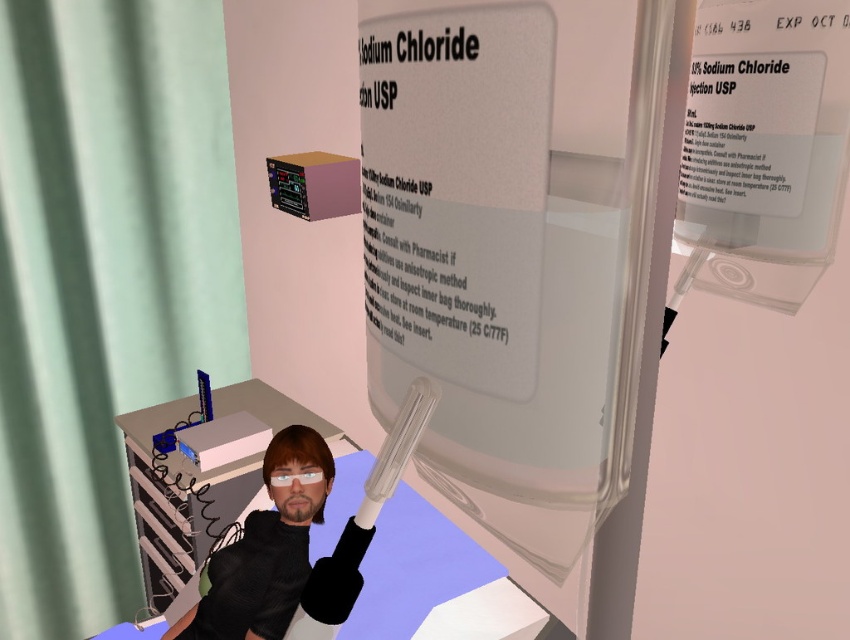
You are a nurse in a hospital room. You need to determine which item is bigger between the light green fabric curtain at left and the smooth black shirt at center. Which one is larger?

The light green fabric curtain at left is larger than the smooth black shirt at center.

You are a nurse in a hospital room. You see a light green fabric curtain at left and a smooth black shirt at center. Which object is taller?

The light green fabric curtain at left is taller than the smooth black shirt at center.